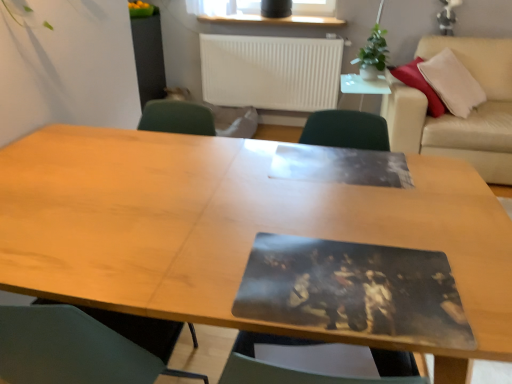
Locate an element on the screen. empty space that is ontop of wooden table at center (from a real-world perspective) is located at coordinates (219, 194).